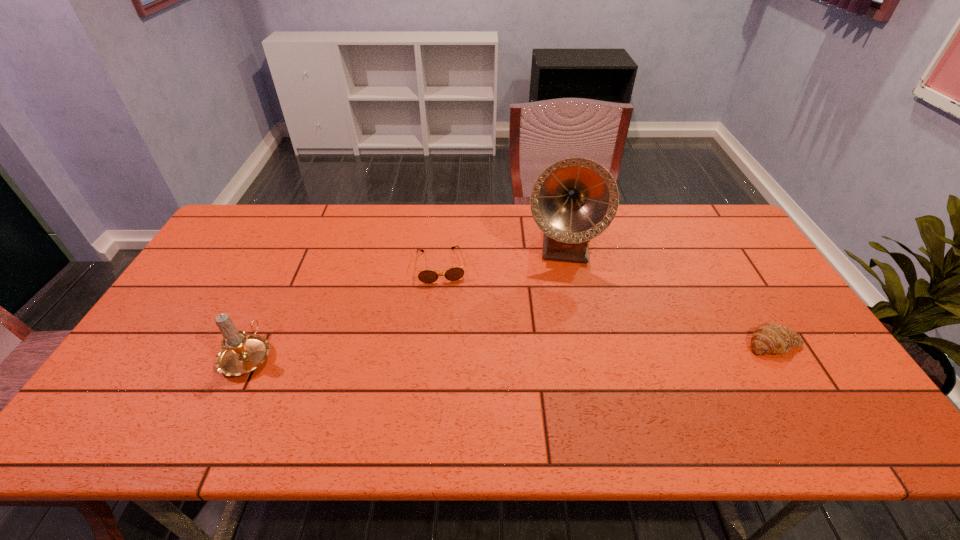
Identify the location of the second tallest object. The height and width of the screenshot is (540, 960). (241, 353).

The width and height of the screenshot is (960, 540). I want to click on the leftmost object, so click(241, 353).

Locate an element on the screen. Image resolution: width=960 pixels, height=540 pixels. the rightmost object is located at coordinates (768, 338).

You are a GUI agent. You are given a task and a screenshot of the screen. Output one action in this format:
    pyautogui.click(x=<x>, y=<y>)
    Task: Click on the tallest object
    
    Given the screenshot: What is the action you would take?
    pyautogui.click(x=574, y=200)

Locate an element on the screen. Image resolution: width=960 pixels, height=540 pixels. the second object from right to left is located at coordinates (574, 200).

The height and width of the screenshot is (540, 960). Find the location of `sunglasses`. sunglasses is located at coordinates (426, 276).

This screenshot has width=960, height=540. I want to click on vacant space situated 0.050m on the right of the candle, so click(293, 355).

The width and height of the screenshot is (960, 540). I want to click on free region located on the left of the crescent roll, so click(x=636, y=344).

Image resolution: width=960 pixels, height=540 pixels. I want to click on free space located on the horn of the tallest object, so click(561, 289).

At what (x,y) coordinates should I click in order to perform the action: click on free location located on the horn of the tallest object. Please return your answer as a coordinate pair (x, y). The height and width of the screenshot is (540, 960). Looking at the image, I should click on (560, 317).